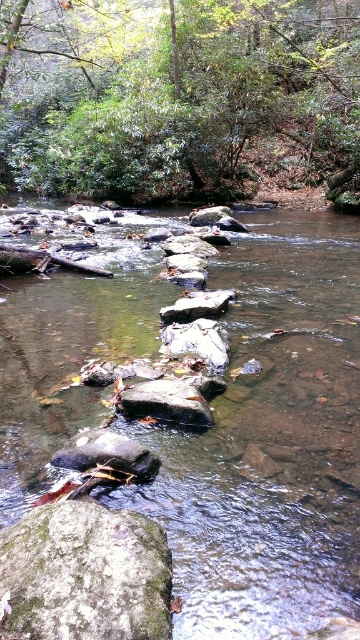
Does green leafy tree at upper center have a lesser width compared to gray smooth rock at center?

No, green leafy tree at upper center is not thinner than gray smooth rock at center.

Is point (246, 106) in front of point (210, 310)?

No, it is not.

Find the location of a particular element. green leafy tree at upper center is located at coordinates (178, 97).

The height and width of the screenshot is (640, 360). In order to click on green leafy tree at upper center in this screenshot , I will do `click(178, 97)`.

Is green mossy rock at lower left bigger than smooth gray rock at center?

Correct, green mossy rock at lower left is larger in size than smooth gray rock at center.

Measure the distance from green mossy rock at lower left to smooth gray rock at center.

green mossy rock at lower left and smooth gray rock at center are 30.38 inches apart.

Is point (137, 534) farther from viewer compared to point (120, 451)?

That is False.

Where is `green mossy rock at lower left`? The width and height of the screenshot is (360, 640). green mossy rock at lower left is located at coordinates (84, 573).

Does smooth gray rock at center have a smaller size compared to gray smooth rock at center?

Yes.

Based on the photo, is smooth gray rock at center to the left of gray smooth rock at center from the viewer's perspective?

Yes, smooth gray rock at center is to the left of gray smooth rock at center.

Locate an element on the screen. smooth gray rock at center is located at coordinates (106, 454).

Locate an element on the screen. The width and height of the screenshot is (360, 640). smooth gray rock at center is located at coordinates (106, 454).